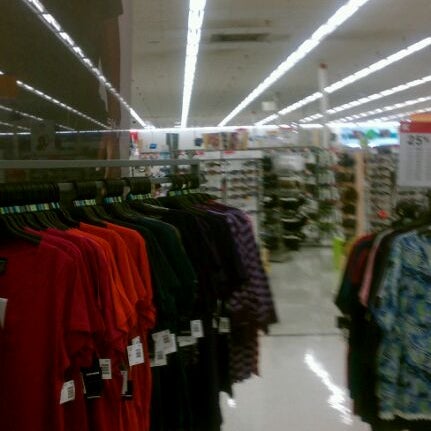
You are a GUI agent. You are given a task and a screenshot of the screen. Output one action in this format:
    pyautogui.click(x=<x>, y=<y>)
    Task: Click on the ceiling
    This screenshot has height=431, width=431.
    Given the screenshot: What is the action you would take?
    229,80